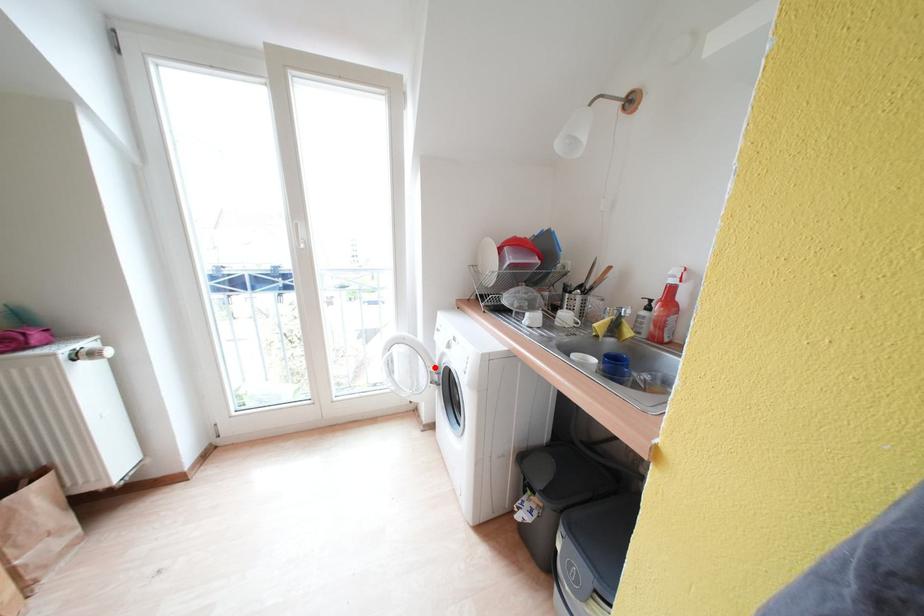
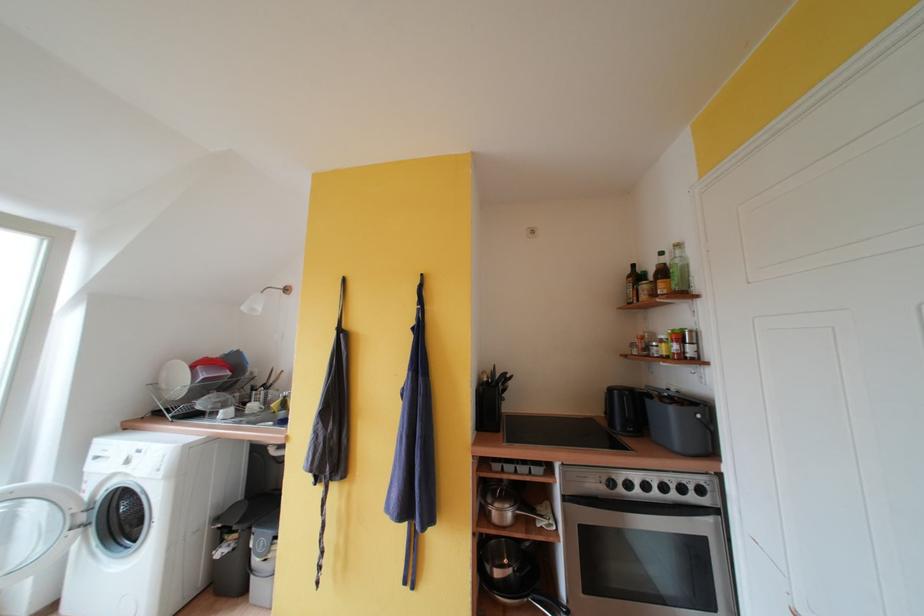
Question: I am providing you with two images of the same scene from different viewpoints. A red point is shown in image1. For the corresponding object point in image2, is it positioned nearer or farther from the camera?

Choices:
 (A) Nearer
 (B) Farther

Answer: (A)